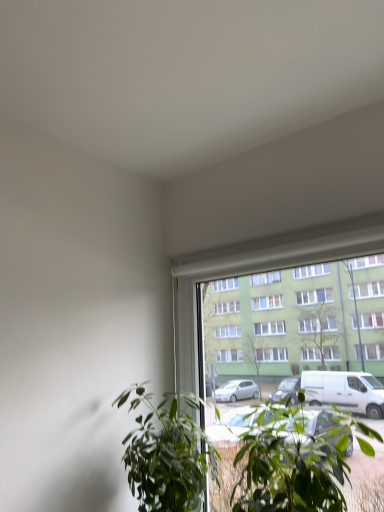
Question: Would you say green leafy plant at center, placed as the 2th houseplant when sorted from left to right, is to the left or to the right of green leafy plant at lower center, arranged as the first houseplant when viewed from the left, in the picture?

Choices:
 (A) right
 (B) left

Answer: (A)

Question: Based on their sizes in the image, would you say green leafy plant at center, which appears as the 1th houseplant when viewed from the right, is bigger or smaller than green leafy plant at lower center, arranged as the first houseplant when viewed from the left?

Choices:
 (A) big
 (B) small

Answer: (A)

Question: Is green leafy plant at center, which appears as the 1th houseplant when viewed from the right, in front of or behind green leafy plant at lower center, arranged as the first houseplant when viewed from the left, in the image?

Choices:
 (A) behind
 (B) front

Answer: (B)

Question: Does point (155, 472) appear closer or farther from the camera than point (175, 411)?

Choices:
 (A) farther
 (B) closer

Answer: (B)

Question: Considering the positions of green leafy plant at lower center, the second houseplant positioned from the right, and green leafy plant at center, which appears as the 1th houseplant when viewed from the right, in the image, is green leafy plant at lower center, the second houseplant positioned from the right, taller or shorter than green leafy plant at center, which appears as the 1th houseplant when viewed from the right,?

Choices:
 (A) tall
 (B) short

Answer: (A)

Question: From a real-world perspective, is green leafy plant at lower center, the second houseplant positioned from the right, positioned above or below green leafy plant at center, placed as the 2th houseplant when sorted from left to right?

Choices:
 (A) below
 (B) above

Answer: (A)

Question: Considering the positions of green leafy plant at lower center, arranged as the first houseplant when viewed from the left, and green leafy plant at center, which appears as the 1th houseplant when viewed from the right, in the image, is green leafy plant at lower center, arranged as the first houseplant when viewed from the left, wider or thinner than green leafy plant at center, which appears as the 1th houseplant when viewed from the right,?

Choices:
 (A) wide
 (B) thin

Answer: (B)